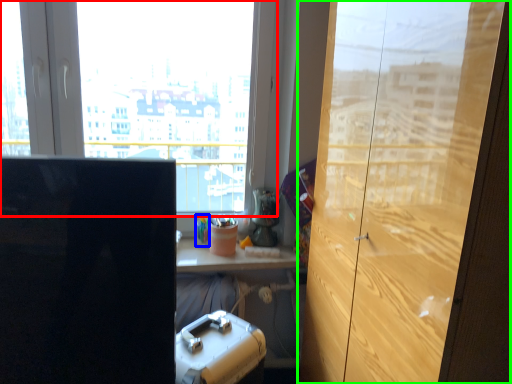
Question: Which is farther away from window (highlighted by a red box)? stationery (highlighted by a blue box) or cupboard (highlighted by a green box)?

Choices:
 (A) stationery
 (B) cupboard

Answer: (B)